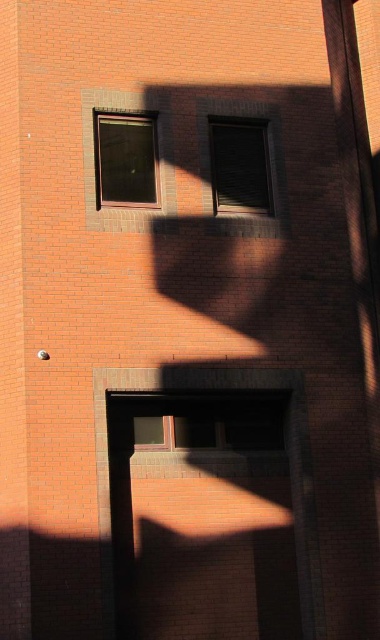
Is matte glass window at upper center taller than matte glass window at center?

Incorrect, matte glass window at upper center's height is not larger of matte glass window at center's.

Does matte glass window at upper center come behind matte glass window at center?

No, it is in front of matte glass window at center.

This screenshot has height=640, width=380. What do you see at coordinates (126, 160) in the screenshot? I see `matte glass window at upper center` at bounding box center [126, 160].

Where is `matte glass window at upper center`? matte glass window at upper center is located at coordinates (126, 160).